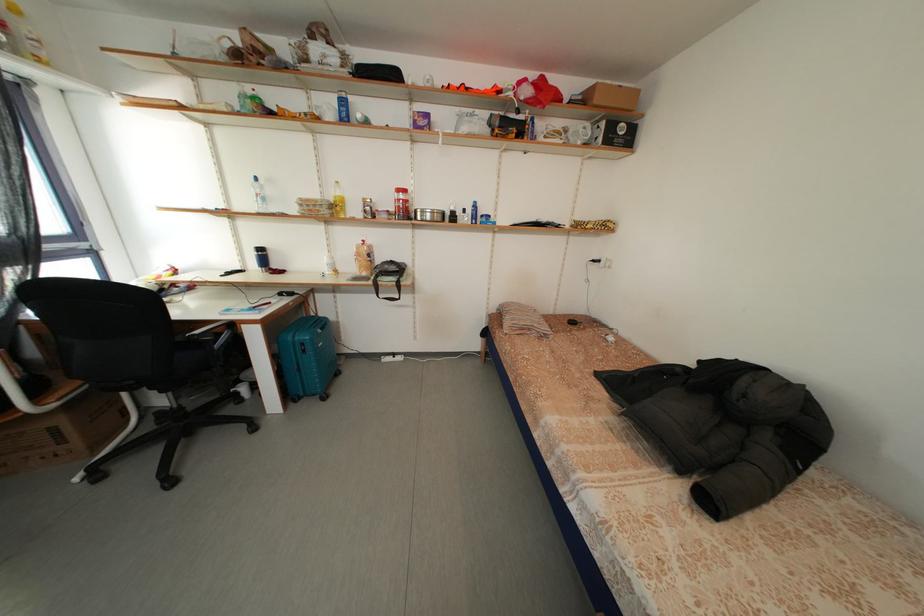
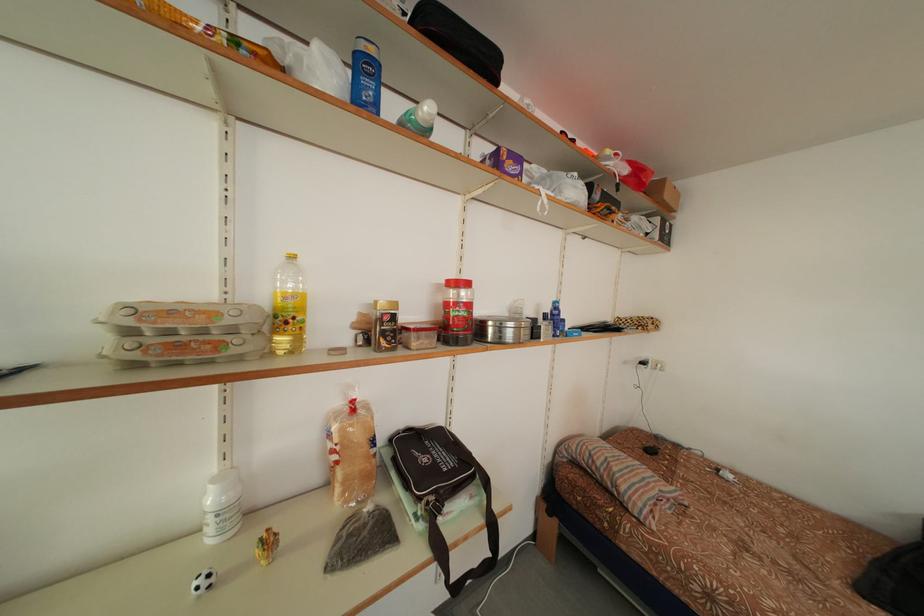
The point at (602, 265) is marked in the first image. Where is the corresponding point in the second image?

(650, 369)